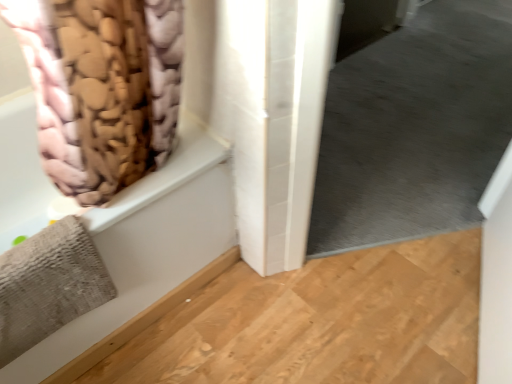
The width and height of the screenshot is (512, 384). Identify the location of beige fabric bath at left. (148, 244).

Find the location of a particular element. Image resolution: width=512 pixels, height=384 pixels. beige fabric bath at left is located at coordinates (148, 244).

Is point (366, 157) positioned after point (12, 155)?

Yes.

Do you think gray matte carpet at lower right is within beige fabric bath at left, or outside of it?

gray matte carpet at lower right is not enclosed by beige fabric bath at left.

Where is `window screen located behind the beige fabric bath at left`? The image size is (512, 384). window screen located behind the beige fabric bath at left is located at coordinates (414, 128).

Consider the image. From a real-world perspective, is beige fabric bath at left over pink fabric curtain at upper left?

Incorrect, from a real-world perspective, beige fabric bath at left is lower than pink fabric curtain at upper left.

The height and width of the screenshot is (384, 512). I want to click on bath lying behind the pink fabric curtain at upper left, so pyautogui.click(x=148, y=244).

Is beige fabric bath at left at the left side of pink fabric curtain at upper left?

Correct, you'll find beige fabric bath at left to the left of pink fabric curtain at upper left.

From a real-world perspective, is beige fabric bath at left under gray matte carpet at lower right?

Indeed, from a real-world perspective, beige fabric bath at left is positioned beneath gray matte carpet at lower right.

Can you confirm if beige fabric bath at left is wider than gray matte carpet at lower right?

Correct, the width of beige fabric bath at left exceeds that of gray matte carpet at lower right.

From the image's perspective, which object appears higher, beige fabric bath at left or gray matte carpet at lower right?

gray matte carpet at lower right is shown above in the image.

From the image's perspective, is pink fabric curtain at upper left located beneath beige fabric bath at left?

No, from the image's perspective, pink fabric curtain at upper left is not below beige fabric bath at left.

Is the position of pink fabric curtain at upper left more distant than that of beige fabric bath at left?

No, pink fabric curtain at upper left is closer to the camera.

Considering the positions of objects pink fabric curtain at upper left and beige fabric bath at left in the image provided, who is more to the right, pink fabric curtain at upper left or beige fabric bath at left?

pink fabric curtain at upper left.

Do you think pink fabric curtain at upper left is within beige fabric bath at left, or outside of it?

pink fabric curtain at upper left is not enclosed by beige fabric bath at left.

From a real-world perspective, who is located lower, gray matte carpet at lower right or pink fabric curtain at upper left?

From a 3D spatial view, gray matte carpet at lower right is below.

From the image's perspective, relative to pink fabric curtain at upper left, is gray matte carpet at lower right above or below?

gray matte carpet at lower right is below pink fabric curtain at upper left.

Would you say gray matte carpet at lower right is outside pink fabric curtain at upper left?

That's correct, gray matte carpet at lower right is outside of pink fabric curtain at upper left.

Between gray matte carpet at lower right and pink fabric curtain at upper left, which one appears on the right side from the viewer's perspective?

From the viewer's perspective, gray matte carpet at lower right appears more on the right side.

Is pink fabric curtain at upper left shorter than gray matte carpet at lower right?

Correct, pink fabric curtain at upper left is not as tall as gray matte carpet at lower right.

In terms of width, does pink fabric curtain at upper left look wider or thinner when compared to gray matte carpet at lower right?

Considering their sizes, pink fabric curtain at upper left looks broader than gray matte carpet at lower right.

Are pink fabric curtain at upper left and gray matte carpet at lower right located far from each other?

Yes, pink fabric curtain at upper left is far from gray matte carpet at lower right.

From a real-world perspective, which is physically above, pink fabric curtain at upper left or gray matte carpet at lower right?

In real-world perspective, pink fabric curtain at upper left is above.

The width and height of the screenshot is (512, 384). I want to click on window screen above the beige fabric bath at left (from the image's perspective), so click(x=414, y=128).

The height and width of the screenshot is (384, 512). Find the location of `bath that appears below the pink fabric curtain at upper left (from the image's perspective)`. bath that appears below the pink fabric curtain at upper left (from the image's perspective) is located at coordinates (148, 244).

Looking at the image, which one is located further to beige fabric bath at left, pink fabric curtain at upper left or gray matte carpet at lower right?

gray matte carpet at lower right.

From the image, which object appears to be farther from gray matte carpet at lower right, beige fabric bath at left or pink fabric curtain at upper left?

pink fabric curtain at upper left lies further to gray matte carpet at lower right than the other object.

From the image, which object appears to be nearer to gray matte carpet at lower right, pink fabric curtain at upper left or beige fabric bath at left?

The object closer to gray matte carpet at lower right is beige fabric bath at left.

Estimate the real-world distances between objects in this image. Which object is further from pink fabric curtain at upper left, gray matte carpet at lower right or beige fabric bath at left?

gray matte carpet at lower right is further to pink fabric curtain at upper left.

Considering their positions, is gray matte carpet at lower right positioned closer to beige fabric bath at left than pink fabric curtain at upper left?

pink fabric curtain at upper left is positioned closer to the anchor beige fabric bath at left.

Looking at the image, which one is located closer to pink fabric curtain at upper left, beige fabric bath at left or gray matte carpet at lower right?

Based on the image, beige fabric bath at left appears to be nearer to pink fabric curtain at upper left.

You are a GUI agent. You are given a task and a screenshot of the screen. Output one action in this format:
    pyautogui.click(x=<x>, y=<y>)
    Task: Click on the curtain between beige fabric bath at left and gray matte carpet at lower right
    This screenshot has height=384, width=512.
    Given the screenshot: What is the action you would take?
    pyautogui.click(x=101, y=88)